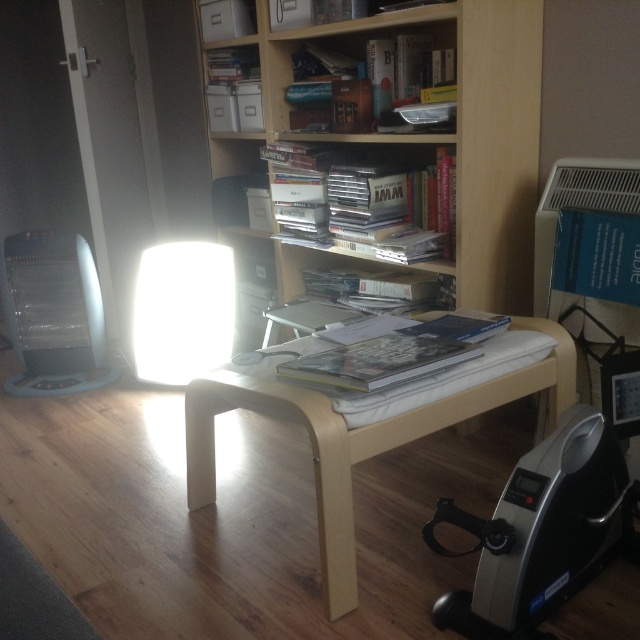
Question: Which point is closer to the camera?

Choices:
 (A) click(x=253, y=141)
 (B) click(x=314, y=108)
 (C) click(x=216, y=308)

Answer: (B)

Question: Considering the relative positions of light wood table at center and hardcover book at upper center in the image provided, where is light wood table at center located with respect to hardcover book at upper center?

Choices:
 (A) below
 (B) above

Answer: (A)

Question: Which object appears farthest from the camera in this image?

Choices:
 (A) wooden bookshelf at upper center
 (B) white matte book at center

Answer: (B)

Question: Where is light wood table at center located in relation to white glossy lampshade at center in the image?

Choices:
 (A) right
 (B) left

Answer: (A)

Question: Based on their relative distances, which object is farther from the white glossy lampshade at center?

Choices:
 (A) hardcover book at upper center
 (B) wooden bookshelf at upper center
 (C) white matte book at center

Answer: (A)

Question: Can you confirm if wooden bookshelf at upper center is bigger than white matte book at center?

Choices:
 (A) no
 (B) yes

Answer: (B)